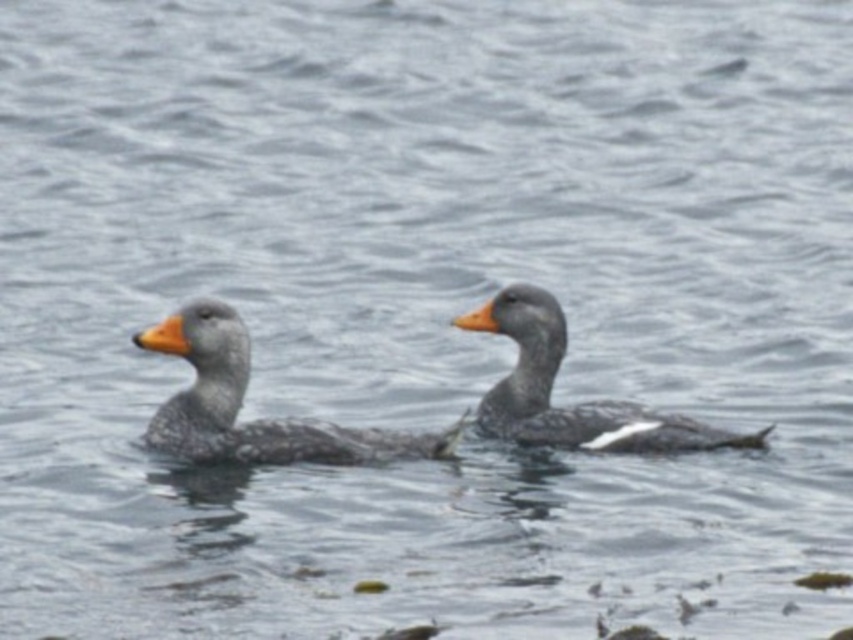
Which of these two, gray speckled duck at center or gray matte duck at center, stands taller?

gray matte duck at center is taller.

Is the position of gray speckled duck at center less distant than that of gray matte duck at center?

Yes, gray speckled duck at center is in front of gray matte duck at center.

Measure the distance between point (372, 444) and camera.

A distance of 16.24 feet exists between point (372, 444) and camera.

At what (x,y) coordinates should I click in order to perform the action: click on gray speckled duck at center. Please return your answer as a coordinate pair (x, y). Looking at the image, I should click on (241, 400).